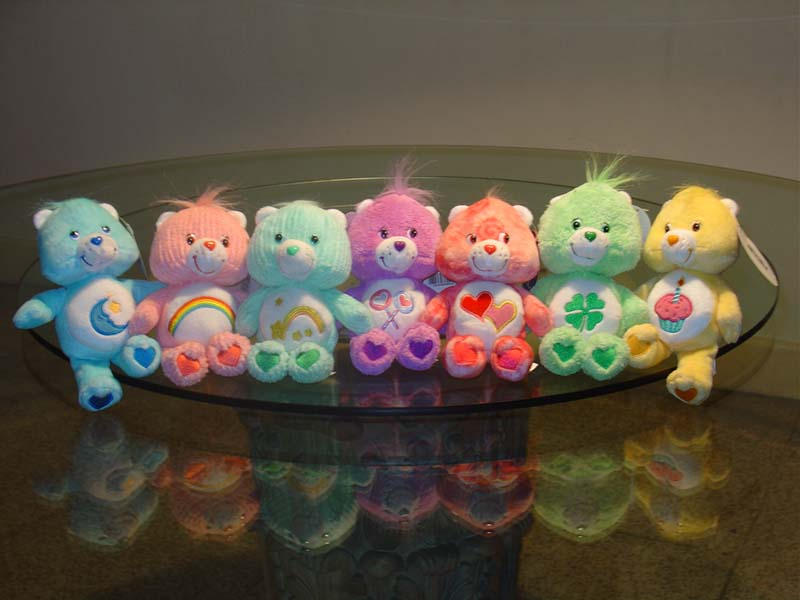
Image resolution: width=800 pixels, height=600 pixels. In order to click on blue moon decoration in this screenshot , I will do `click(96, 319)`.